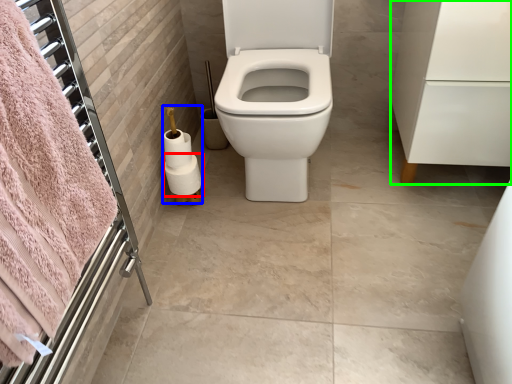
Question: Estimate the real-world distances between objects in this image. Which object is farther from toilet paper (highlighted by a red box), toilet paper (highlighted by a blue box) or porcelain (highlighted by a green box)?

Choices:
 (A) toilet paper
 (B) porcelain

Answer: (B)